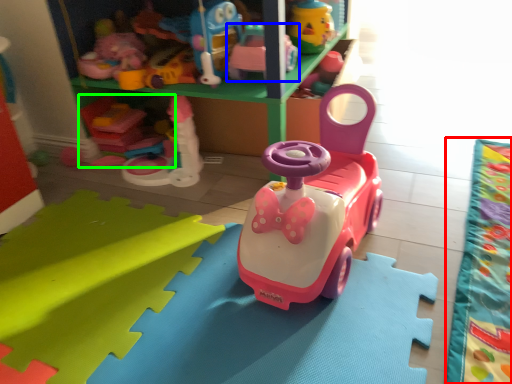
Question: Which object is positioned farthest from blanket (highlighted by a red box)? Select from toy (highlighted by a blue box) and toy (highlighted by a green box).

Choices:
 (A) toy
 (B) toy

Answer: (B)